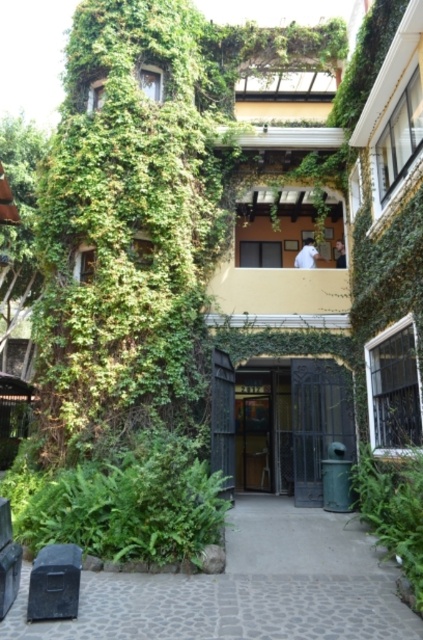
Question: Is green leafy bush at lower left further to camera compared to metallic gate at center?

Choices:
 (A) no
 (B) yes

Answer: (A)

Question: Can you confirm if gray cobblestone alley at center is positioned below green leafy bush at lower left?

Choices:
 (A) no
 (B) yes

Answer: (B)

Question: From the image, what is the correct spatial relationship of gray cobblestone alley at center in relation to green leafy bush at lower left?

Choices:
 (A) below
 (B) above

Answer: (A)

Question: Which point is farther to the camera?

Choices:
 (A) (351, 493)
 (B) (351, 413)

Answer: (B)

Question: Which object appears farthest from the camera in this image?

Choices:
 (A) green leafy plant at lower right
 (B) gray cobblestone alley at center
 (C) metallic gate at center
 (D) green leafy bush at lower left

Answer: (C)

Question: Which object is positioned farthest from the green leafy plant at lower right?

Choices:
 (A) gray cobblestone alley at center
 (B) metallic gate at center

Answer: (B)